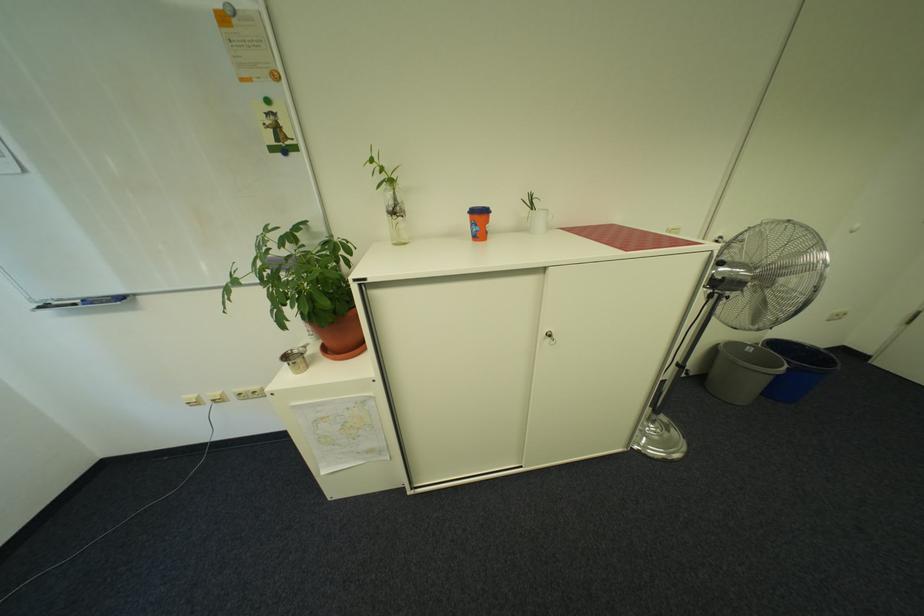
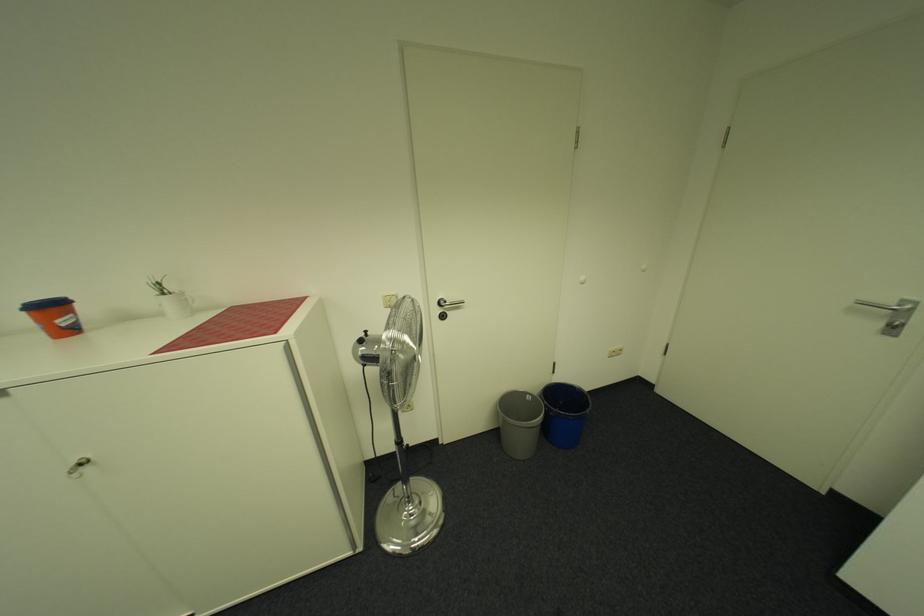
Question: In a continuous first-person perspective shot, in which direction is the camera moving?

Choices:
 (A) Left
 (B) Right
 (C) Forward
 (D) Backward

Answer: (B)